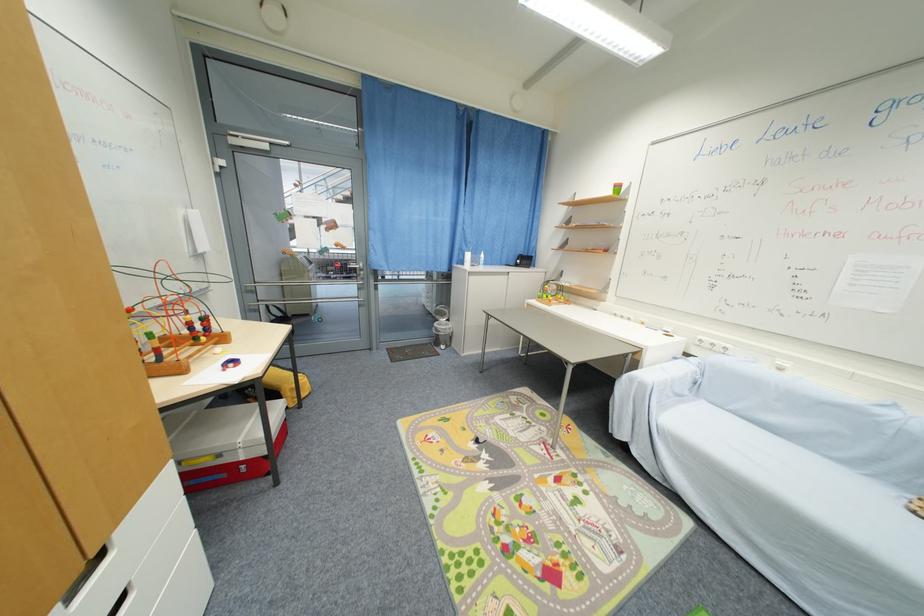
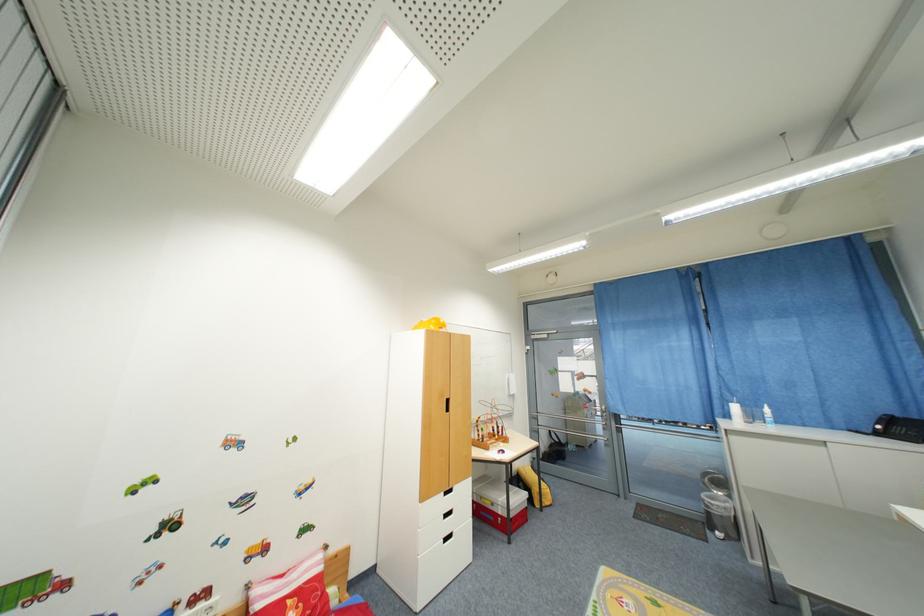
The point at (x=473, y=257) is marked in the first image. Where is the corresponding point in the second image?

(740, 410)